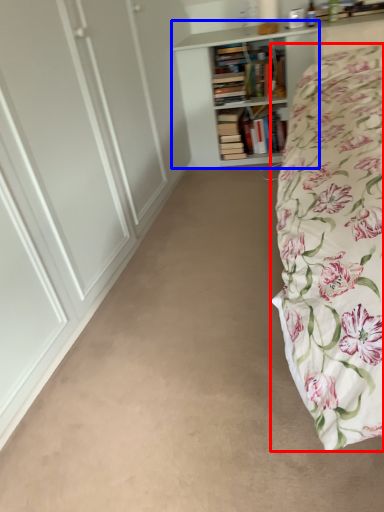
Question: Which point is closer to the camera, bed (highlighted by a red box) or bookcase (highlighted by a blue box)?

Choices:
 (A) bed
 (B) bookcase

Answer: (A)